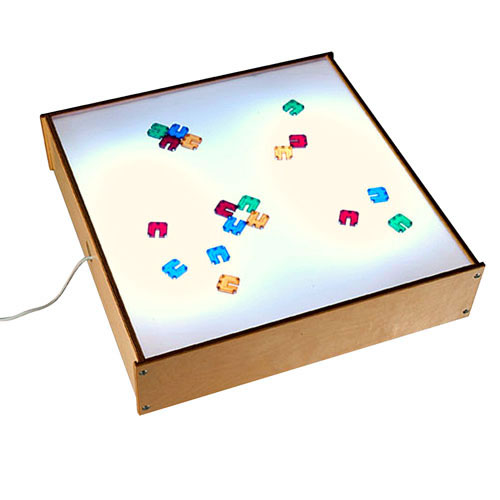
Identify the location of lower left light box corner. (138, 362).